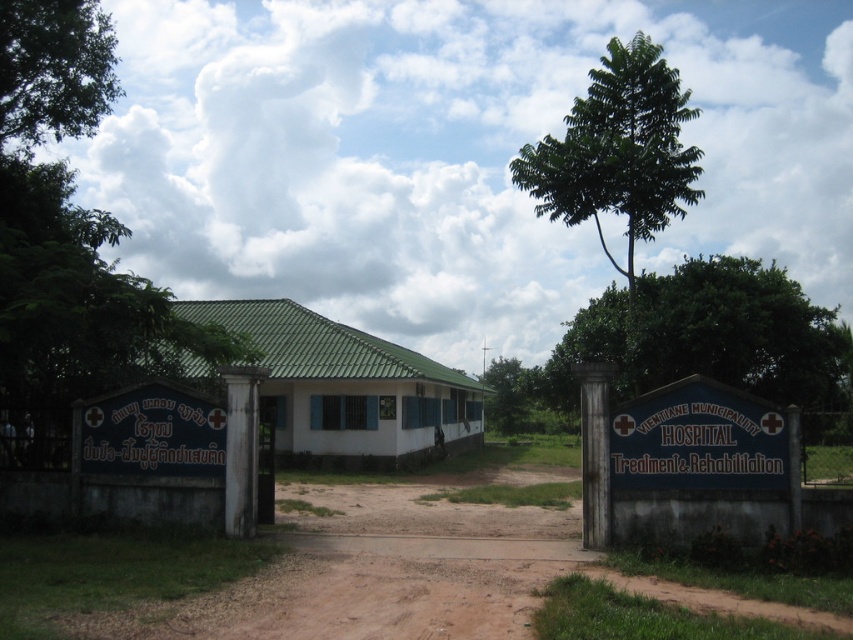
You are a delivery person with a cart that is 5 feet wide. You need to navigate through the entrance of the Vientiane Municipality Hospital. Can your cart fit between the brown dirt field at center and the blue painted signboard at center?

The brown dirt field at center and blue painted signboard at center are 8.72 feet apart from each other. Since your cart is 5 feet wide, it can fit through the space between them.

Consider the image. You are standing at the entrance of the Vientiane Municipality Hospital and need to locate two points marked on the ground. The first point is at coordinate point (503, 600) and the second is at point (672, 138). Based on the scene description, which point is closer to the hospital entrance?

Point (503, 600) is in front of point (672, 138), so the first point is closer to the hospital entrance.

You are a patient arriving at the Vientiane Municipality Hospital entrance. You need to park your car on the brown dirt field at center and then walk to the green leafy tree at upper center. In which direction should you turn after parking to reach the tree?

The brown dirt field at center is to the left of the green leafy tree at upper center, so after parking, you should turn to your right to face the tree.